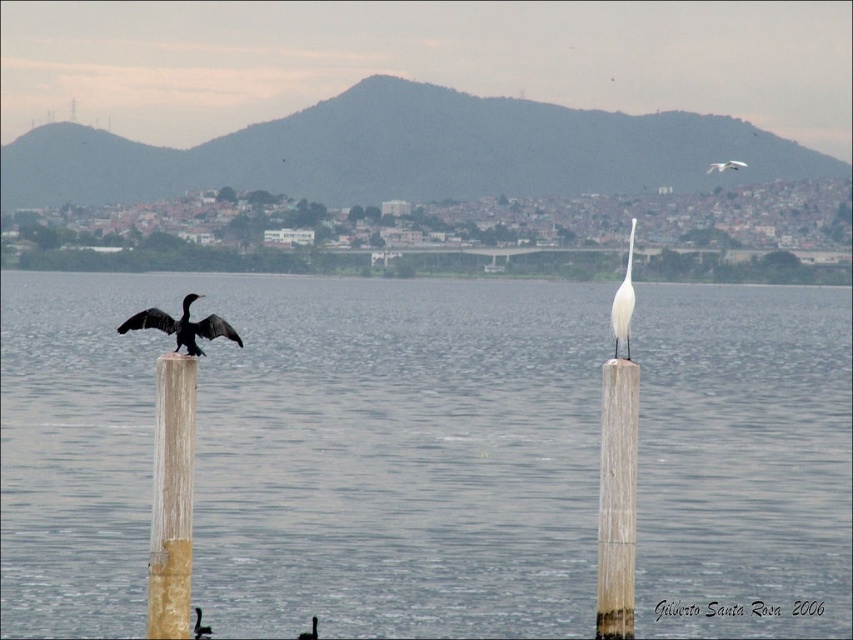
Can you confirm if black glossy bird at left is wider than white glossy bird at upper center?

No.

Measure the distance between black glossy bird at left and white glossy bird at upper center.

22.96 meters

Does point (213, 333) come closer to viewer compared to point (730, 161)?

Yes, point (213, 333) is in front of point (730, 161).

I want to click on black glossy bird at left, so click(x=183, y=324).

Between point (173, 320) and point (630, 292), which one is positioned in front?

Point (173, 320) is more forward.

This screenshot has width=853, height=640. What do you see at coordinates (183, 324) in the screenshot?
I see `black glossy bird at left` at bounding box center [183, 324].

This screenshot has width=853, height=640. I want to click on black glossy bird at left, so click(x=183, y=324).

Is transparent water at center to the right of white glossy bird at upper center from the viewer's perspective?

In fact, transparent water at center is to the left of white glossy bird at upper center.

Which is behind, point (456, 624) or point (717, 166)?

Point (717, 166)

Where is `transparent water at center`? transparent water at center is located at coordinates (309, 456).